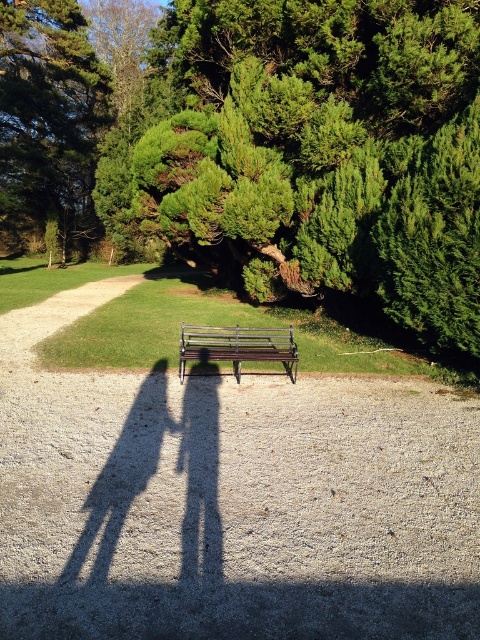
Question: Among these objects, which one is farthest from the camera?

Choices:
 (A) green leafy tree at upper left
 (B) wooden bench at center

Answer: (A)

Question: Does green leafy tree at upper left have a greater width compared to wooden bench at center?

Choices:
 (A) yes
 (B) no

Answer: (A)

Question: Among these points, which one is farthest from the camera?

Choices:
 (A) (104, 125)
 (B) (211, 332)

Answer: (A)

Question: Which of the following is the closest to the observer?

Choices:
 (A) (266, 349)
 (B) (40, 64)

Answer: (A)

Question: Is green leafy tree at upper left wider than wooden bench at center?

Choices:
 (A) yes
 (B) no

Answer: (A)

Question: Does green leafy tree at upper left appear on the left side of wooden bench at center?

Choices:
 (A) no
 (B) yes

Answer: (B)